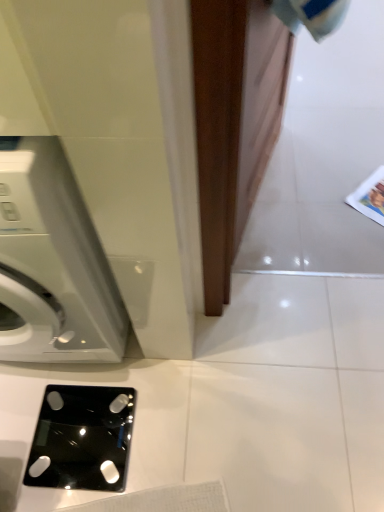
Question: Considering the relative sizes of black glass scale at lower center and white glossy washing machine at left in the image provided, is black glass scale at lower center taller than white glossy washing machine at left?

Choices:
 (A) no
 (B) yes

Answer: (A)

Question: Is black glass scale at lower center shorter than white glossy washing machine at left?

Choices:
 (A) yes
 (B) no

Answer: (A)

Question: From a real-world perspective, is black glass scale at lower center physically above white glossy washing machine at left?

Choices:
 (A) yes
 (B) no

Answer: (B)

Question: From the image's perspective, is black glass scale at lower center on top of white glossy washing machine at left?

Choices:
 (A) no
 (B) yes

Answer: (A)

Question: Is black glass scale at lower center not inside white glossy washing machine at left?

Choices:
 (A) no
 (B) yes

Answer: (B)

Question: Is black glass scale at lower center turned away from white glossy washing machine at left?

Choices:
 (A) no
 (B) yes

Answer: (B)

Question: Does white glossy washing machine at left have a larger size compared to black glass scale at lower center?

Choices:
 (A) yes
 (B) no

Answer: (A)

Question: Is white glossy washing machine at left positioned with its back to black glass scale at lower center?

Choices:
 (A) yes
 (B) no

Answer: (B)

Question: Considering the relative sizes of white glossy washing machine at left and black glass scale at lower center in the image provided, is white glossy washing machine at left wider than black glass scale at lower center?

Choices:
 (A) yes
 (B) no

Answer: (A)

Question: Considering the relative sizes of white glossy washing machine at left and black glass scale at lower center in the image provided, is white glossy washing machine at left smaller than black glass scale at lower center?

Choices:
 (A) yes
 (B) no

Answer: (B)

Question: Is white glossy washing machine at left not inside black glass scale at lower center?

Choices:
 (A) no
 (B) yes

Answer: (B)

Question: Is white glossy washing machine at left positioned before black glass scale at lower center?

Choices:
 (A) yes
 (B) no

Answer: (A)

Question: Is black glass scale at lower center situated inside white glossy washing machine at left or outside?

Choices:
 (A) inside
 (B) outside

Answer: (B)